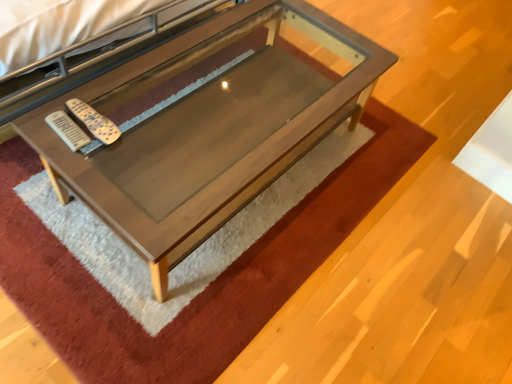
Question: Is wooden table at center thinner than white plastic remote at center-left, placed as the 1th remote when sorted from right to left?

Choices:
 (A) no
 (B) yes

Answer: (A)

Question: Is wooden table at center smaller than white plastic remote at center-left, placed as the 1th remote when sorted from right to left?

Choices:
 (A) no
 (B) yes

Answer: (A)

Question: From a real-world perspective, does wooden table at center stand above white plastic remote at center-left, placed as the 1th remote when sorted from right to left?

Choices:
 (A) yes
 (B) no

Answer: (B)

Question: Does wooden table at center touch white plastic remote at center-left, which is the 2th remote from left to right?

Choices:
 (A) no
 (B) yes

Answer: (A)

Question: Are wooden table at center and white plastic remote at center-left, which is the 2th remote from left to right, located far from each other?

Choices:
 (A) no
 (B) yes

Answer: (A)

Question: Is point (73, 147) closer or farther from the camera than point (96, 117)?

Choices:
 (A) farther
 (B) closer

Answer: (B)

Question: In terms of height, does white plastic remote at left, marked as the second remote in a right-to-left arrangement, look taller or shorter compared to white plastic remote at center-left, which is the 2th remote from left to right?

Choices:
 (A) tall
 (B) short

Answer: (B)

Question: Considering the positions of white plastic remote at left, marked as the second remote in a right-to-left arrangement, and white plastic remote at center-left, which is the 2th remote from left to right, in the image, is white plastic remote at left, marked as the second remote in a right-to-left arrangement, bigger or smaller than white plastic remote at center-left, which is the 2th remote from left to right,?

Choices:
 (A) small
 (B) big

Answer: (A)

Question: Is white plastic remote at left, marked as the second remote in a right-to-left arrangement, in front of or behind white plastic remote at center-left, which is the 2th remote from left to right, in the image?

Choices:
 (A) behind
 (B) front

Answer: (B)

Question: In terms of width, does white plastic remote at center-left, placed as the 1th remote when sorted from right to left, look wider or thinner when compared to white plastic remote at left, placed as the 1th remote when sorted from left to right?

Choices:
 (A) thin
 (B) wide

Answer: (B)

Question: Is point (86, 105) closer or farther from the camera than point (72, 127)?

Choices:
 (A) closer
 (B) farther

Answer: (B)

Question: From the image's perspective, is white plastic remote at center-left, placed as the 1th remote when sorted from right to left, located above or below white plastic remote at left, marked as the second remote in a right-to-left arrangement?

Choices:
 (A) below
 (B) above

Answer: (B)

Question: From a real-world perspective, is white plastic remote at center-left, placed as the 1th remote when sorted from right to left, physically located above or below white plastic remote at left, placed as the 1th remote when sorted from left to right?

Choices:
 (A) below
 (B) above

Answer: (B)

Question: Considering the relative positions of white plastic remote at center-left, placed as the 1th remote when sorted from right to left, and wooden table at center in the image provided, is white plastic remote at center-left, placed as the 1th remote when sorted from right to left, to the left or to the right of wooden table at center?

Choices:
 (A) right
 (B) left

Answer: (B)

Question: Considering their positions, is white plastic remote at center-left, placed as the 1th remote when sorted from right to left, located in front of or behind wooden table at center?

Choices:
 (A) front
 (B) behind

Answer: (B)